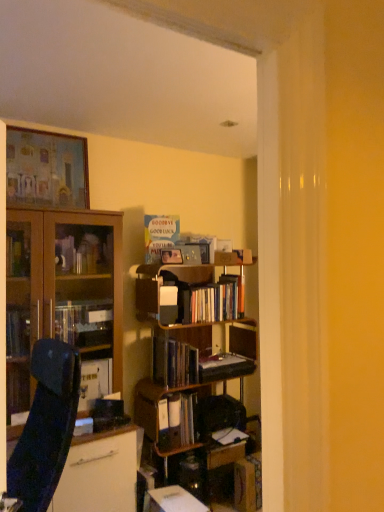
Question: Is point [x=67, y=153] closer or farther from the camera than point [x=210, y=478]?

Choices:
 (A) farther
 (B) closer

Answer: (B)

Question: In terms of height, does matte wooden picture frame at upper left look taller or shorter compared to wooden bookcase at center?

Choices:
 (A) tall
 (B) short

Answer: (B)

Question: Considering the real-world distances, which object is farthest from the wooden cabinet at left?

Choices:
 (A) hardcover book at center, the first book when ordered from bottom to top
 (B) hardcover book at center
 (C) hardcover books at center, placed as the 2th book when sorted from top to bottom
 (D) wooden bookcase at center
 (E) hardcover book at center, which is counted as the fourth book, starting from the top

Answer: (A)

Question: Estimate the real-world distances between objects in this image. Which object is closer to the wooden bookcase at center?

Choices:
 (A) hardcover books at center, which ranks as the fourth book in bottom-to-top order
 (B) hardcover book at center, placed as the 3th book when sorted from bottom to top
 (C) hardcover book at center, which is counted as the fourth book, starting from the top
 (D) matte wooden picture frame at upper left
 (E) wooden cabinet at left

Answer: (B)